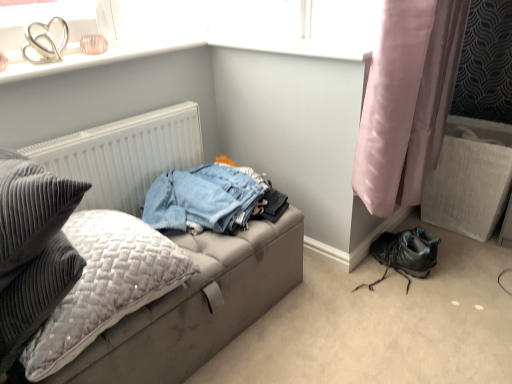
Image resolution: width=512 pixels, height=384 pixels. What are the coordinates of `free location to the right of leatherette studio couch at left` in the screenshot? It's located at (349, 331).